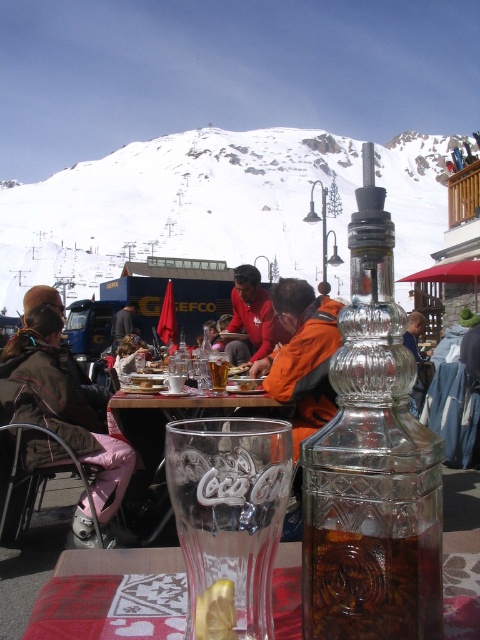
You are standing at the center of the image and want to reach the transparent glass bottle at center. What direction should you move in to get there?

The transparent glass bottle at center is already at the center of the image, so you don not need to move in any direction to reach it.